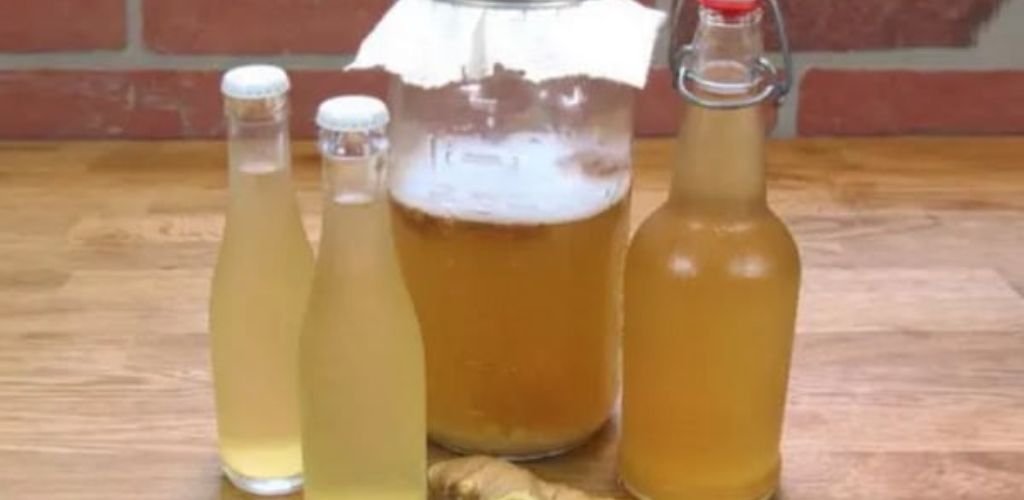
This screenshot has width=1024, height=500. Find the location of `glass jar`. glass jar is located at coordinates (482, 286).